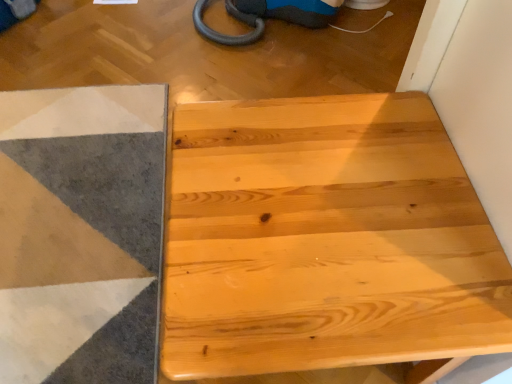
Question: Would you say natural wood table at center is to the left or to the right of soft gray carpet at lower left in the picture?

Choices:
 (A) left
 (B) right

Answer: (B)

Question: Would you say natural wood table at center is inside or outside soft gray carpet at lower left?

Choices:
 (A) outside
 (B) inside

Answer: (A)

Question: Considering the positions of natural wood table at center and soft gray carpet at lower left in the image, is natural wood table at center wider or thinner than soft gray carpet at lower left?

Choices:
 (A) thin
 (B) wide

Answer: (A)

Question: Would you say soft gray carpet at lower left is to the left or to the right of natural wood table at center in the picture?

Choices:
 (A) left
 (B) right

Answer: (A)

Question: Looking at their shapes, would you say soft gray carpet at lower left is wider or thinner than natural wood table at center?

Choices:
 (A) thin
 (B) wide

Answer: (B)

Question: From a real-world perspective, is soft gray carpet at lower left positioned above or below natural wood table at center?

Choices:
 (A) below
 (B) above

Answer: (A)

Question: From the image's perspective, relative to natural wood table at center, is soft gray carpet at lower left above or below?

Choices:
 (A) above
 (B) below

Answer: (A)